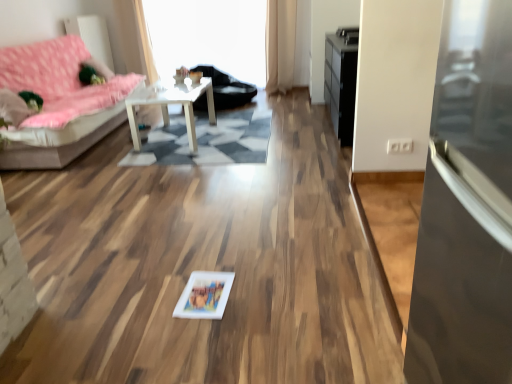
Locate an element on the screen. This screenshot has width=512, height=384. vacant space in front of beige fabric curtain at upper center is located at coordinates point(283,96).